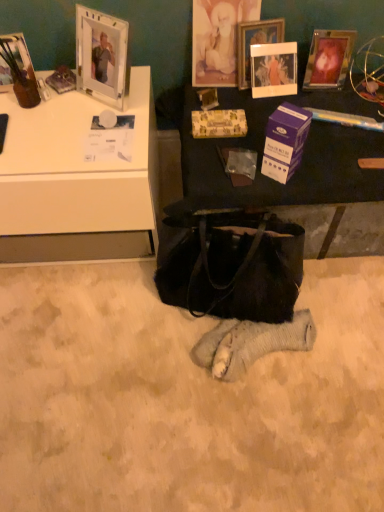
Locate an element on the screen. free spot to the right of purple cardboard box at center is located at coordinates (333, 162).